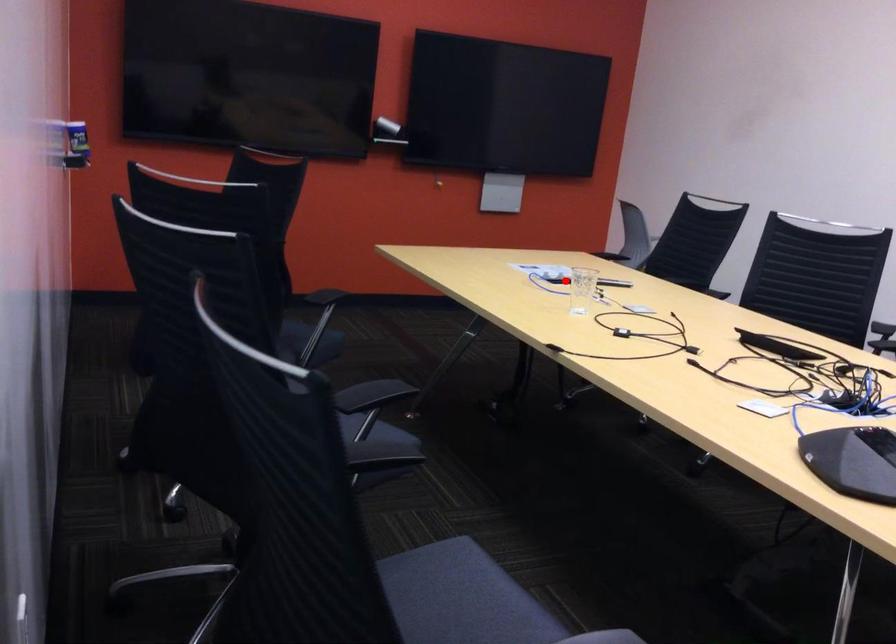
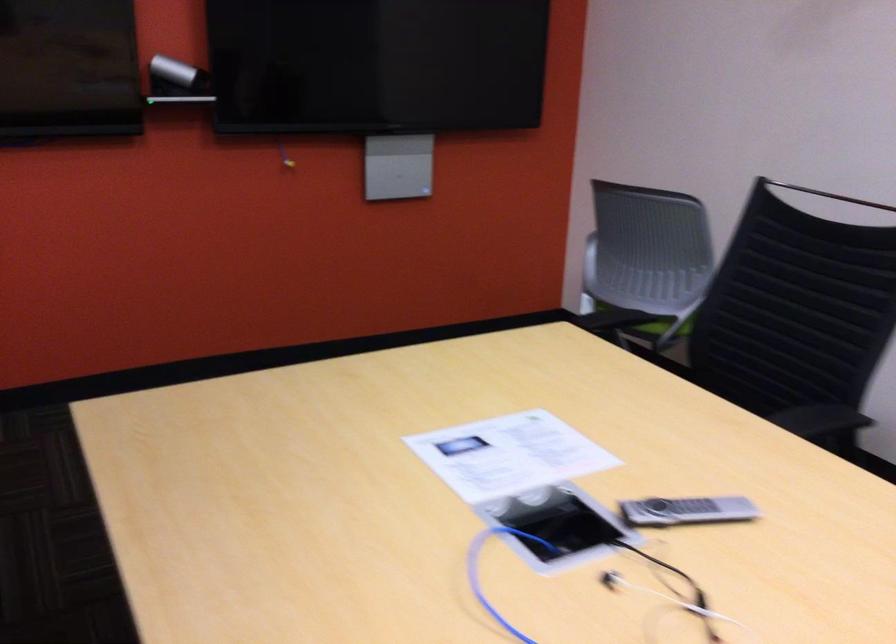
The point at the highlighted location is marked in the first image. Where is the corresponding point in the second image?

(576, 583)